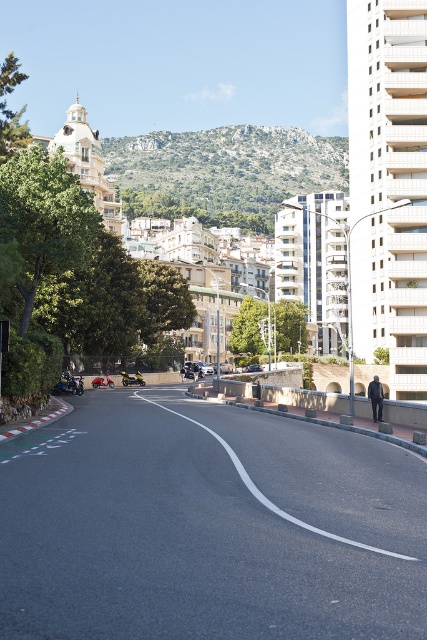
Between rocky brown hillside at upper center and black asphalt road at center, which one is positioned higher?

Positioned higher is rocky brown hillside at upper center.

Between point (161, 144) and point (281, 515), which one is positioned behind?

Positioned behind is point (161, 144).

This screenshot has height=640, width=427. Find the location of `rocky brown hillside at upper center`. rocky brown hillside at upper center is located at coordinates (222, 172).

Which is more to the left, black asphalt road at center or shiny chrome motorcycle at lower left?

shiny chrome motorcycle at lower left is more to the left.

Which is below, black asphalt road at center or shiny chrome motorcycle at lower left?

Positioned lower is shiny chrome motorcycle at lower left.

What do you see at coordinates (271, 500) in the screenshot? This screenshot has height=640, width=427. I see `black asphalt road at center` at bounding box center [271, 500].

Where is `black asphalt road at center`? Image resolution: width=427 pixels, height=640 pixels. black asphalt road at center is located at coordinates (271, 500).

Which of these two, black asphalt road at center or shiny black car at center, stands shorter?

With less height is shiny black car at center.

Consider the image. Who is more distant from viewer, (242, 481) or (251, 365)?

Positioned behind is point (251, 365).

Between point (386, 550) and point (249, 365), which one is positioned in front?

Point (386, 550) is more forward.

This screenshot has height=640, width=427. I want to click on black asphalt road at center, so click(x=271, y=500).